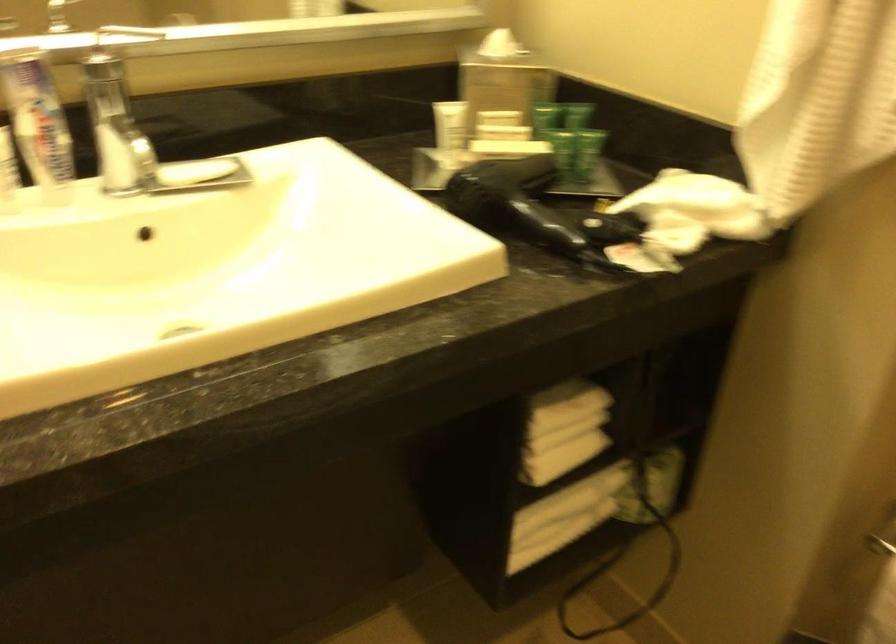
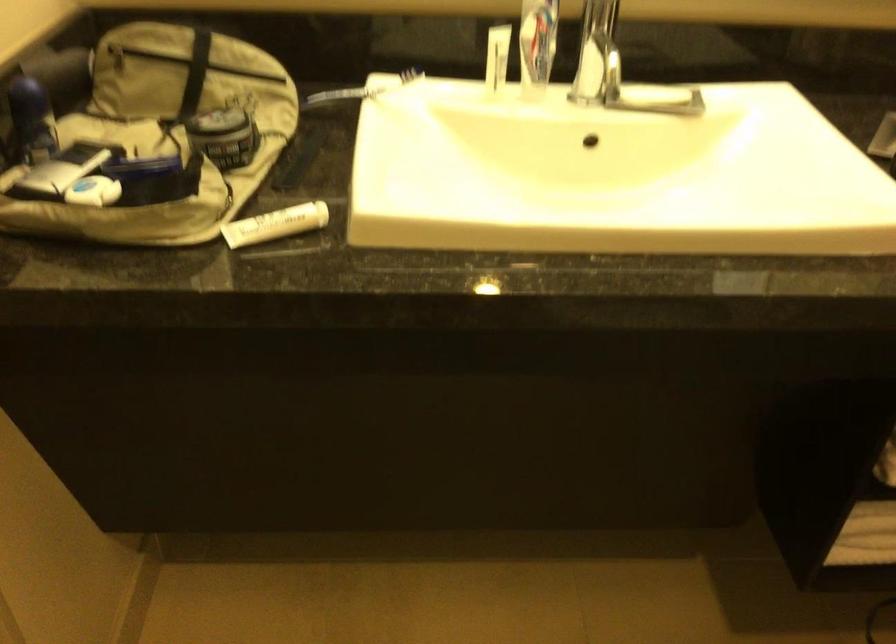
Question: The camera is either moving clockwise (left) or counter-clockwise (right) around the object. The first image is from the beginning of the video and the second image is from the end. Is the camera moving left or right when shooting the video?

Choices:
 (A) Left
 (B) Right

Answer: (B)